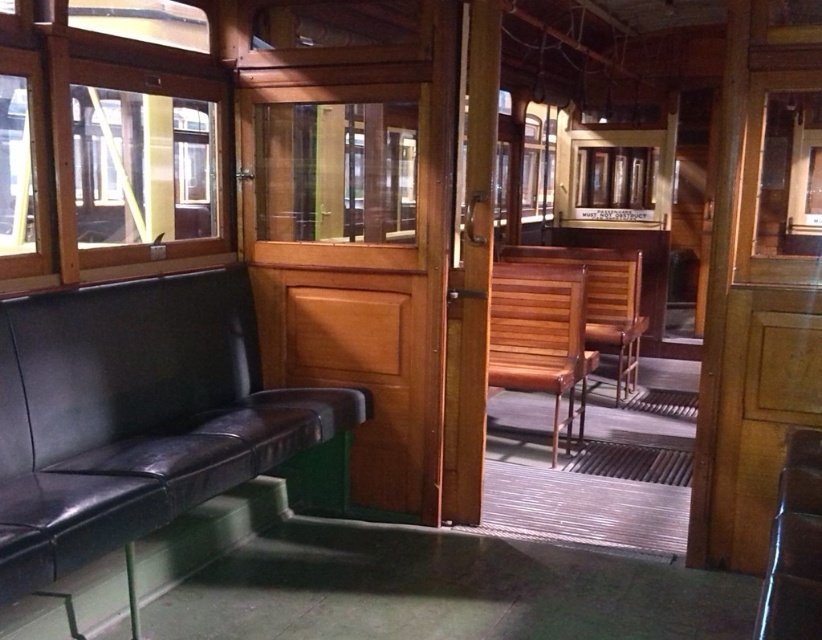
Who is higher up, metallic silver chair at center or wooden slats chair at center?

wooden slats chair at center

Is metallic silver chair at center to the left of wooden slats chair at center from the viewer's perspective?

Correct, you'll find metallic silver chair at center to the left of wooden slats chair at center.

Which is behind, point (788, 458) or point (589, 282)?

Point (589, 282)

This screenshot has height=640, width=822. I want to click on metallic silver chair at center, so click(793, 547).

Does black leather couch at left have a smaller size compared to metallic silver chair at center?

No.

Locate an element on the screen. Image resolution: width=822 pixels, height=640 pixels. black leather couch at left is located at coordinates (135, 417).

Who is lower down, black leather couch at left or wooden slats chair at center?

black leather couch at left

Does black leather couch at left appear over wooden slats chair at center?

Actually, black leather couch at left is below wooden slats chair at center.

This screenshot has width=822, height=640. Identify the location of black leather couch at left. (135, 417).